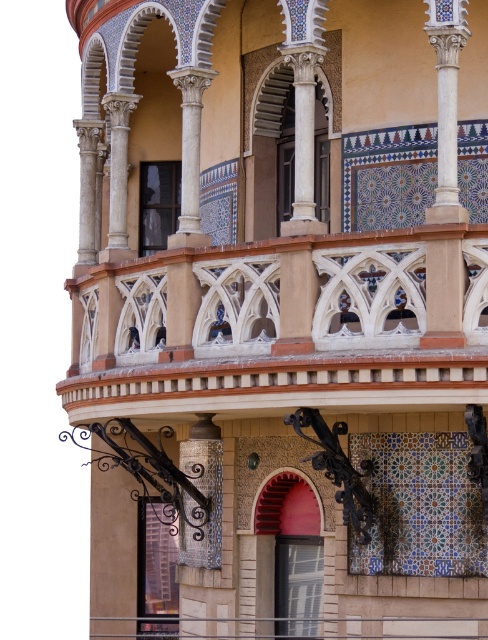
Question: Does white stone balcony at center have a larger size compared to matte glass window at center?

Choices:
 (A) yes
 (B) no

Answer: (A)

Question: Does clear glass window at center appear on the left side of matte glass window at center?

Choices:
 (A) no
 (B) yes

Answer: (A)

Question: Considering the real-world distances, which object is closest to the matte glass window at lower center?

Choices:
 (A) matte glass window at center
 (B) white stone balcony at center

Answer: (A)

Question: Among these objects, which one is farthest from the camera?

Choices:
 (A) matte glass window at lower center
 (B) white stone balcony at center
 (C) clear glass window at center
 (D) matte glass window at center

Answer: (A)

Question: Is clear glass window at center bigger than matte glass window at center?

Choices:
 (A) yes
 (B) no

Answer: (A)

Question: Among these objects, which one is farthest from the camera?

Choices:
 (A) white stone balcony at center
 (B) matte glass window at center
 (C) clear glass window at center
 (D) matte glass window at lower center

Answer: (D)